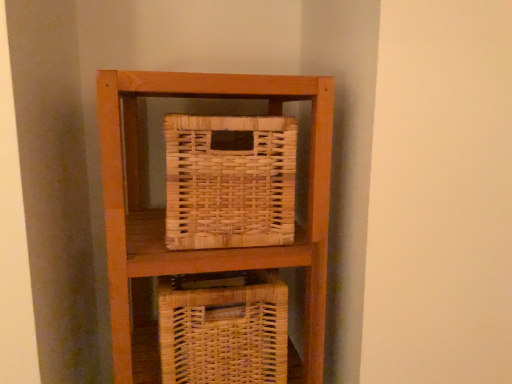
Question: Should I look upward or downward to see woven natural basket at center?

Choices:
 (A) down
 (B) up

Answer: (A)

Question: Is natural wicker picnic basket at center positioned beyond the bounds of woven natural basket at center?

Choices:
 (A) yes
 (B) no

Answer: (A)

Question: Is natural wicker picnic basket at center at the right side of woven natural basket at center?

Choices:
 (A) yes
 (B) no

Answer: (A)

Question: Considering the relative sizes of natural wicker picnic basket at center and woven natural basket at center in the image provided, is natural wicker picnic basket at center smaller than woven natural basket at center?

Choices:
 (A) no
 (B) yes

Answer: (B)

Question: Does natural wicker picnic basket at center turn towards woven natural basket at center?

Choices:
 (A) no
 (B) yes

Answer: (A)

Question: Is natural wicker picnic basket at center not near woven natural basket at center?

Choices:
 (A) no
 (B) yes

Answer: (A)

Question: Considering the relative positions of natural wicker picnic basket at center and woven natural basket at center in the image provided, is natural wicker picnic basket at center to the left of woven natural basket at center from the viewer's perspective?

Choices:
 (A) no
 (B) yes

Answer: (A)

Question: From the image's perspective, is woven natural basket at center above natural wicker picnic basket at center?

Choices:
 (A) no
 (B) yes

Answer: (A)

Question: From a real-world perspective, is woven natural basket at center positioned under natural wicker picnic basket at center based on gravity?

Choices:
 (A) yes
 (B) no

Answer: (A)

Question: Is woven natural basket at center in front of natural wicker picnic basket at center?

Choices:
 (A) no
 (B) yes

Answer: (A)

Question: Considering the relative sizes of woven natural basket at center and natural wicker picnic basket at center in the image provided, is woven natural basket at center shorter than natural wicker picnic basket at center?

Choices:
 (A) no
 (B) yes

Answer: (A)

Question: Considering the relative positions of woven natural basket at center and natural wicker picnic basket at center in the image provided, is woven natural basket at center behind natural wicker picnic basket at center?

Choices:
 (A) no
 (B) yes

Answer: (B)

Question: Can you confirm if woven natural basket at center is thinner than natural wicker picnic basket at center?

Choices:
 (A) no
 (B) yes

Answer: (A)

Question: Based on their sizes in the image, would you say natural wicker picnic basket at center is bigger or smaller than woven natural basket at center?

Choices:
 (A) big
 (B) small

Answer: (B)